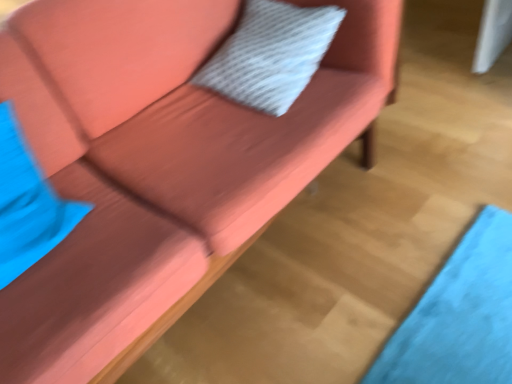
The image size is (512, 384). Describe the element at coordinates (28, 204) in the screenshot. I see `blue fabric pillow at left, the 2th pillow from the right` at that location.

You are a GUI agent. You are given a task and a screenshot of the screen. Output one action in this format:
    pyautogui.click(x=<x>, y=<y>)
    Task: Click on the blue fabric pillow at left, the 2th pillow from the back
    
    Given the screenshot: What is the action you would take?
    pyautogui.click(x=28, y=204)

The width and height of the screenshot is (512, 384). Find the location of `white textured pillow at center, positioned as the second pillow in bottom-to-top order`. white textured pillow at center, positioned as the second pillow in bottom-to-top order is located at coordinates (270, 54).

Describe the element at coordinates (270, 54) in the screenshot. The width and height of the screenshot is (512, 384). I see `white textured pillow at center, which is counted as the first pillow, starting from the top` at that location.

The image size is (512, 384). Find the location of `blue fabric pillow at left, the 2th pillow from the back`. blue fabric pillow at left, the 2th pillow from the back is located at coordinates (28, 204).

Does white textured pillow at center, which is counted as the first pillow, starting from the top, appear on the left side of blue fabric pillow at left, which ranks as the first pillow in left-to-right order?

Incorrect, white textured pillow at center, which is counted as the first pillow, starting from the top, is not on the left side of blue fabric pillow at left, which ranks as the first pillow in left-to-right order.

Relative to blue fabric pillow at left, which is the 1th pillow from front to back, is white textured pillow at center, the 1th pillow in the right-to-left sequence, in front or behind?

Clearly, white textured pillow at center, the 1th pillow in the right-to-left sequence, is behind blue fabric pillow at left, which is the 1th pillow from front to back.

Does point (281, 21) appear closer or farther from the camera than point (25, 174)?

Point (281, 21) appears to be farther away from the viewer than point (25, 174).

From the image's perspective, which is below, white textured pillow at center, which is counted as the first pillow, starting from the top, or blue fabric pillow at left, the 2th pillow from the right?

blue fabric pillow at left, the 2th pillow from the right, is shown below in the image.

Consider the image. From a real-world perspective, who is located lower, white textured pillow at center, which is the second pillow in left-to-right order, or blue fabric pillow at left, placed as the second pillow when sorted from top to bottom?

white textured pillow at center, which is the second pillow in left-to-right order, is physically lower.

Considering the relative sizes of white textured pillow at center, positioned as the second pillow in bottom-to-top order, and blue fabric pillow at left, which ranks as the first pillow in left-to-right order, in the image provided, is white textured pillow at center, positioned as the second pillow in bottom-to-top order, thinner than blue fabric pillow at left, which ranks as the first pillow in left-to-right order,?

Incorrect, the width of white textured pillow at center, positioned as the second pillow in bottom-to-top order, is not less than that of blue fabric pillow at left, which ranks as the first pillow in left-to-right order.

Considering the sizes of white textured pillow at center, which is the second pillow in left-to-right order, and blue fabric pillow at left, the 2th pillow from the back, in the image, is white textured pillow at center, which is the second pillow in left-to-right order, taller or shorter than blue fabric pillow at left, the 2th pillow from the back,?

In the image, white textured pillow at center, which is the second pillow in left-to-right order, appears to be shorter than blue fabric pillow at left, the 2th pillow from the back.

Between white textured pillow at center, which is counted as the first pillow, starting from the top, and blue fabric pillow at left, which is the 1th pillow from front to back, which one has larger size?

With larger size is white textured pillow at center, which is counted as the first pillow, starting from the top.

Is white textured pillow at center, positioned as the second pillow in bottom-to-top order, surrounding blue fabric pillow at left, the 2th pillow from the right?

That's incorrect, blue fabric pillow at left, the 2th pillow from the right, is not inside white textured pillow at center, positioned as the second pillow in bottom-to-top order.

Is white textured pillow at center, the 1th pillow in the right-to-left sequence, with blue fabric pillow at left, which ranks as the first pillow in bottom-to-top order?

No.

Is white textured pillow at center, which appears as the second pillow when viewed from the front, aimed at blue fabric pillow at left, which ranks as the first pillow in left-to-right order?

Yes, white textured pillow at center, which appears as the second pillow when viewed from the front, is aimed at blue fabric pillow at left, which ranks as the first pillow in left-to-right order.

You are a GUI agent. You are given a task and a screenshot of the screen. Output one action in this format:
    pyautogui.click(x=<x>, y=<y>)
    Task: Click on the pillow that appears below the white textured pillow at center, which appears as the second pillow when viewed from the front (from the image's perspective)
    The image size is (512, 384).
    Given the screenshot: What is the action you would take?
    pyautogui.click(x=28, y=204)

Between blue fabric pillow at left, placed as the second pillow when sorted from top to bottom, and white textured pillow at center, which is the second pillow in left-to-right order, which one appears on the right side from the viewer's perspective?

white textured pillow at center, which is the second pillow in left-to-right order.

Which object is closer to the camera, blue fabric pillow at left, which is the 1th pillow from front to back, or white textured pillow at center, which is the second pillow in left-to-right order?

→ blue fabric pillow at left, which is the 1th pillow from front to back.

Is point (7, 280) more distant than point (282, 9)?

No.

From the image's perspective, does blue fabric pillow at left, which ranks as the first pillow in bottom-to-top order, appear lower than white textured pillow at center, the 1th pillow in the right-to-left sequence?

Yes.

From a real-world perspective, does blue fabric pillow at left, the 2th pillow from the right, stand above white textured pillow at center, which is counted as the first pillow, starting from the top?

Yes, from a real-world perspective, blue fabric pillow at left, the 2th pillow from the right, is over white textured pillow at center, which is counted as the first pillow, starting from the top

Looking at their sizes, would you say blue fabric pillow at left, which ranks as the first pillow in bottom-to-top order, is wider or thinner than white textured pillow at center, positioned as the second pillow in bottom-to-top order?

Clearly, blue fabric pillow at left, which ranks as the first pillow in bottom-to-top order, has less width compared to white textured pillow at center, positioned as the second pillow in bottom-to-top order.

Between blue fabric pillow at left, placed as the second pillow when sorted from top to bottom, and white textured pillow at center, which appears as the second pillow when viewed from the front, which one has less height?

With less height is white textured pillow at center, which appears as the second pillow when viewed from the front.

Considering the sizes of objects blue fabric pillow at left, the 2th pillow from the back, and white textured pillow at center, which is counted as the first pillow, starting from the top, in the image provided, who is smaller, blue fabric pillow at left, the 2th pillow from the back, or white textured pillow at center, which is counted as the first pillow, starting from the top,?

With smaller size is blue fabric pillow at left, the 2th pillow from the back.

Is white textured pillow at center, which is counted as the first pillow, starting from the top, inside blue fabric pillow at left, which is the 1th pillow from front to back?

No, white textured pillow at center, which is counted as the first pillow, starting from the top, is not surrounded by blue fabric pillow at left, which is the 1th pillow from front to back.

Are blue fabric pillow at left, placed as the second pillow when sorted from top to bottom, and white textured pillow at center, positioned as the second pillow in bottom-to-top order, located far from each other?

No.

Is blue fabric pillow at left, the 2th pillow from the right, facing towards white textured pillow at center, which is the second pillow in left-to-right order?

No, blue fabric pillow at left, the 2th pillow from the right, is not aimed at white textured pillow at center, which is the second pillow in left-to-right order.

How different are the orientations of blue fabric pillow at left, the 2th pillow from the right, and white textured pillow at center, positioned as the second pillow in bottom-to-top order, in degrees?

88.9 degrees separate the facing orientations of blue fabric pillow at left, the 2th pillow from the right, and white textured pillow at center, positioned as the second pillow in bottom-to-top order.

I want to click on pillow above the blue fabric pillow at left, which ranks as the first pillow in bottom-to-top order (from the image's perspective), so click(x=270, y=54).

You are a GUI agent. You are given a task and a screenshot of the screen. Output one action in this format:
    pyautogui.click(x=<x>, y=<y>)
    Task: Click on the pillow located in front of the white textured pillow at center, the 1th pillow in the right-to-left sequence
    
    Given the screenshot: What is the action you would take?
    [28, 204]

At what (x,y) coordinates should I click in order to perform the action: click on pillow on the right of blue fabric pillow at left, the 2th pillow from the right. Please return your answer as a coordinate pair (x, y). Image resolution: width=512 pixels, height=384 pixels. Looking at the image, I should click on (270, 54).